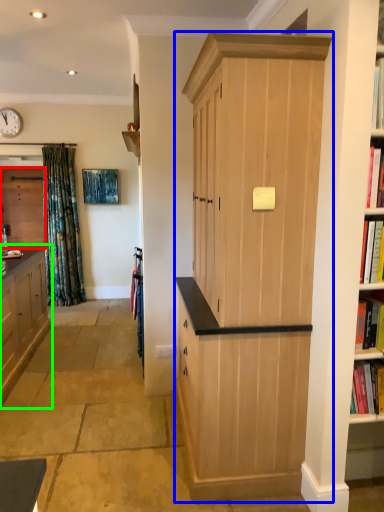
Question: Which object is the closest to the cabinetry (highlighted by a red box)? Choose among these: cabinetry (highlighted by a blue box) or cabinetry (highlighted by a green box).

Choices:
 (A) cabinetry
 (B) cabinetry

Answer: (B)